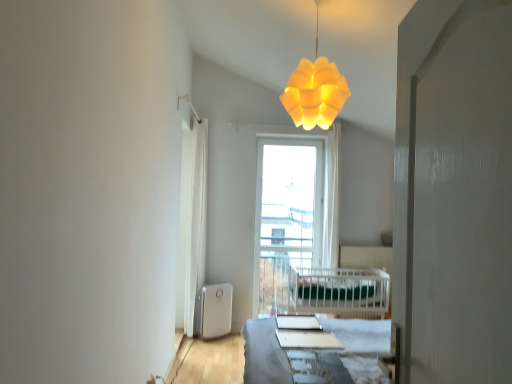
Question: Considering the relative sizes of white glossy table at center and white glossy screen door at right in the image provided, is white glossy table at center wider than white glossy screen door at right?

Choices:
 (A) no
 (B) yes

Answer: (B)

Question: Is white glossy table at center facing towards white glossy screen door at right?

Choices:
 (A) yes
 (B) no

Answer: (B)

Question: Can you confirm if white glossy table at center is positioned to the left of white glossy screen door at right?

Choices:
 (A) yes
 (B) no

Answer: (A)

Question: Considering the relative sizes of white glossy table at center and white glossy screen door at right in the image provided, is white glossy table at center smaller than white glossy screen door at right?

Choices:
 (A) yes
 (B) no

Answer: (A)

Question: Would you consider white glossy table at center to be distant from white glossy screen door at right?

Choices:
 (A) yes
 (B) no

Answer: (A)

Question: From a real-world perspective, relative to white fabric curtain at left, is transparent glass window at center vertically above or below?

Choices:
 (A) below
 (B) above

Answer: (A)

Question: Which is correct: transparent glass window at center is inside white fabric curtain at left, or outside of it?

Choices:
 (A) inside
 (B) outside

Answer: (B)

Question: In terms of size, does transparent glass window at center appear bigger or smaller than white fabric curtain at left?

Choices:
 (A) big
 (B) small

Answer: (A)

Question: In terms of width, does transparent glass window at center look wider or thinner when compared to white fabric curtain at left?

Choices:
 (A) wide
 (B) thin

Answer: (B)

Question: Is white glossy screen door at right bigger or smaller than yellow matte lampshade at upper center?

Choices:
 (A) big
 (B) small

Answer: (B)

Question: Considering the positions of white glossy screen door at right and yellow matte lampshade at upper center in the image, is white glossy screen door at right taller or shorter than yellow matte lampshade at upper center?

Choices:
 (A) short
 (B) tall

Answer: (B)

Question: Would you say white glossy screen door at right is inside or outside yellow matte lampshade at upper center?

Choices:
 (A) outside
 (B) inside

Answer: (A)

Question: Looking at their shapes, would you say white glossy screen door at right is wider or thinner than yellow matte lampshade at upper center?

Choices:
 (A) thin
 (B) wide

Answer: (A)

Question: Considering the positions of white glossy table at center and white glossy screen door at right in the image, is white glossy table at center bigger or smaller than white glossy screen door at right?

Choices:
 (A) small
 (B) big

Answer: (A)

Question: From a real-world perspective, is white glossy table at center positioned above or below white glossy screen door at right?

Choices:
 (A) above
 (B) below

Answer: (B)